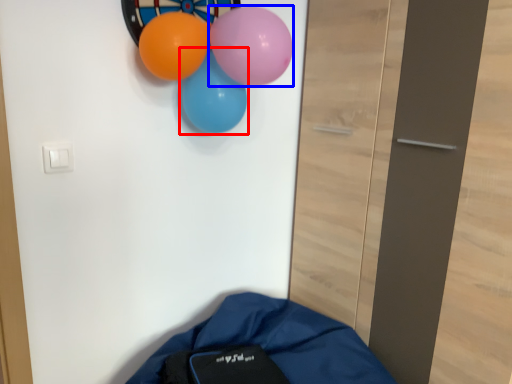
Question: Which object appears closest to the camera in this image, balloon (highlighted by a red box) or balloon (highlighted by a blue box)?

Choices:
 (A) balloon
 (B) balloon

Answer: (B)